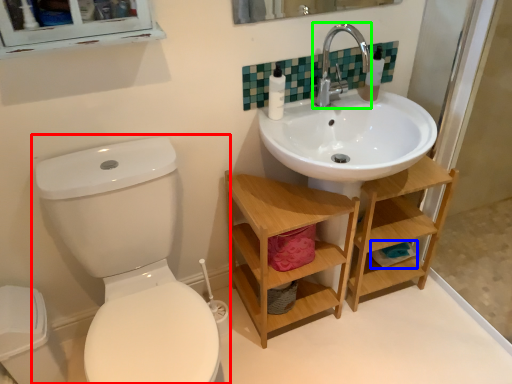
Question: Based on their relative distances, which object is farther from toilet (highlighted by a red box)? Choose from toilet paper (highlighted by a blue box) and tap (highlighted by a green box).

Choices:
 (A) toilet paper
 (B) tap

Answer: (A)